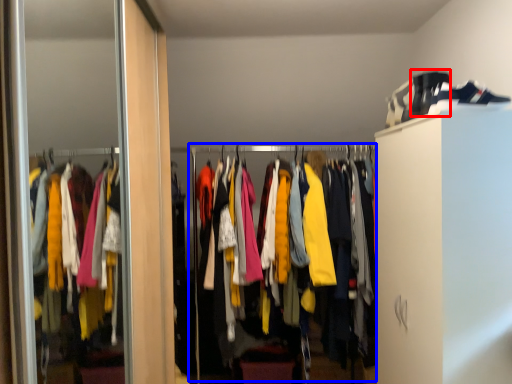
Question: Which point is closer to the camera, shoe (highlighted by a red box) or closet (highlighted by a blue box)?

Choices:
 (A) shoe
 (B) closet

Answer: (A)